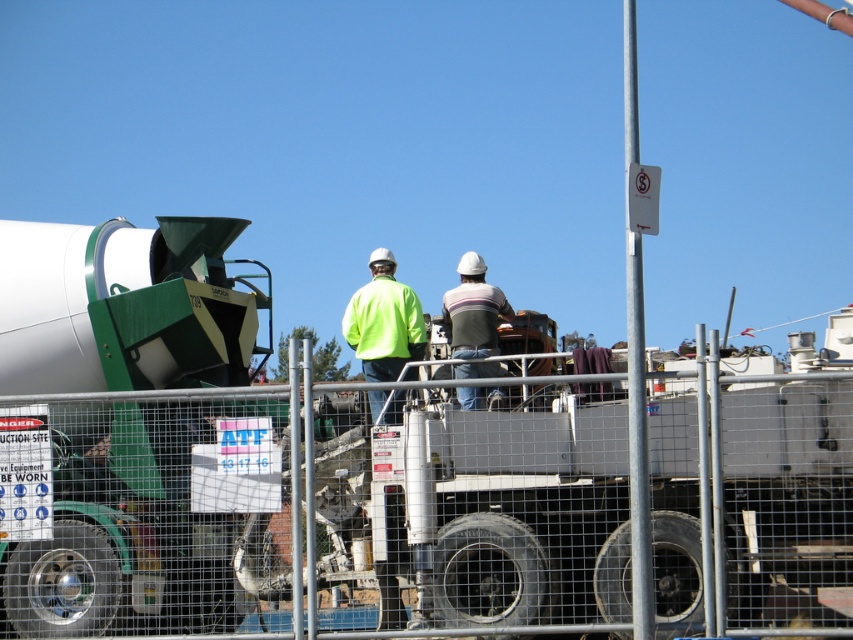
You are a safety inspector at the construction site and need to identify the worker with the larger safety gear. Which worker should you approach first, the one wearing the neon yellow jacket at center or the one wearing the striped cotton shirt at center?

You should approach the worker wearing the neon yellow jacket at center first because the neon yellow jacket at center is larger in size than the striped cotton shirt at center, indicating it might be the correct safety gear required for the site.

You are a safety inspector at the construction site. You need to ensure that the silver metallic pole at upper center and the neon yellow jacket at center are visible from the control tower. Given that the pole is bigger, which object is more likely to be easily visible from a distance?

The silver metallic pole at upper center is bigger than the neon yellow jacket at center, so it is more likely to be easily visible from a distance.

You are a safety inspector at the construction site and need to ensure workers are positioned safely. You see the neon yellow jacket at center and the striped cotton shirt at center. Which worker is closer to the left side of the scene?

The neon yellow jacket at center is closer to the left side of the scene because it is positioned to the left of the striped cotton shirt at center.